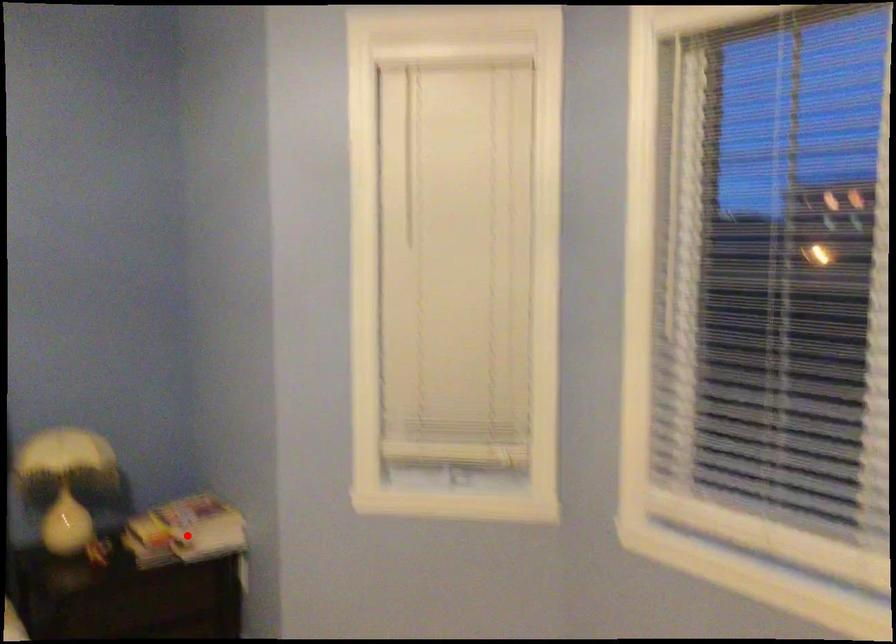
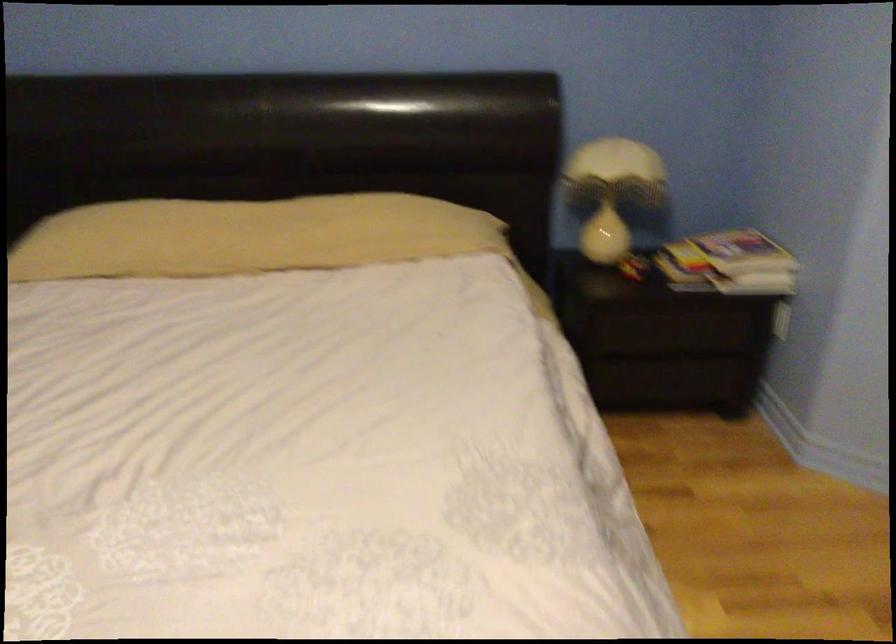
Question: I am providing you with two images of the same scene from different viewpoints. Image1 has a red point marked. In image2, the corresponding 3D location appears at what relative position? Reply with the corresponding letter.

Choices:
 (A) Closer
 (B) Farther

Answer: (A)